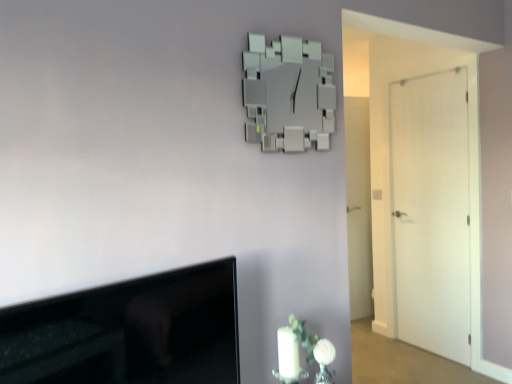
Question: Can you confirm if white matte vase at lower right is positioned to the left of black glossy tv at lower left?

Choices:
 (A) yes
 (B) no

Answer: (B)

Question: From the image's perspective, is white matte vase at lower right on top of black glossy tv at lower left?

Choices:
 (A) yes
 (B) no

Answer: (B)

Question: Is black glossy tv at lower left located within white matte vase at lower right?

Choices:
 (A) no
 (B) yes

Answer: (A)

Question: From a real-world perspective, does white matte vase at lower right stand above black glossy tv at lower left?

Choices:
 (A) yes
 (B) no

Answer: (B)

Question: Does white matte vase at lower right come behind black glossy tv at lower left?

Choices:
 (A) no
 (B) yes

Answer: (B)

Question: Considering the positions of black glossy tv at lower left and white matte door at right, which appears as the first door when viewed from the front, in the image, is black glossy tv at lower left taller or shorter than white matte door at right, which appears as the first door when viewed from the front,?

Choices:
 (A) tall
 (B) short

Answer: (B)

Question: Is black glossy tv at lower left bigger or smaller than white matte door at right, which appears as the first door when viewed from the front?

Choices:
 (A) big
 (B) small

Answer: (B)

Question: From the image's perspective, is black glossy tv at lower left above or below white matte door at right, the 2th door positioned from the back?

Choices:
 (A) below
 (B) above

Answer: (A)

Question: Is black glossy tv at lower left to the left or to the right of white matte door at right, the second door when ordered from left to right, in the image?

Choices:
 (A) right
 (B) left

Answer: (B)

Question: Looking at the image, does white matte vase at lower right seem bigger or smaller compared to black glossy tv at lower left?

Choices:
 (A) small
 (B) big

Answer: (A)

Question: Is white matte vase at lower right taller or shorter than black glossy tv at lower left?

Choices:
 (A) tall
 (B) short

Answer: (B)

Question: From the image's perspective, relative to black glossy tv at lower left, is white matte vase at lower right above or below?

Choices:
 (A) above
 (B) below

Answer: (B)

Question: Is white matte vase at lower right inside or outside of black glossy tv at lower left?

Choices:
 (A) inside
 (B) outside

Answer: (B)

Question: In terms of height, does white matte door at right, the 2th door positioned from the back, look taller or shorter compared to black glossy tv at lower left?

Choices:
 (A) short
 (B) tall

Answer: (B)

Question: Is white matte door at right, which is the first door in right-to-left order, inside or outside of black glossy tv at lower left?

Choices:
 (A) inside
 (B) outside

Answer: (B)